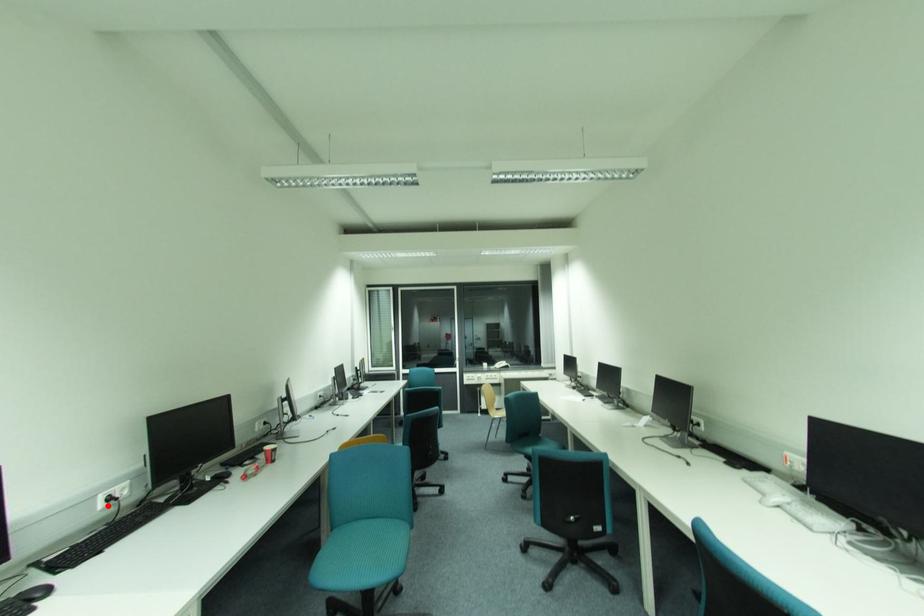
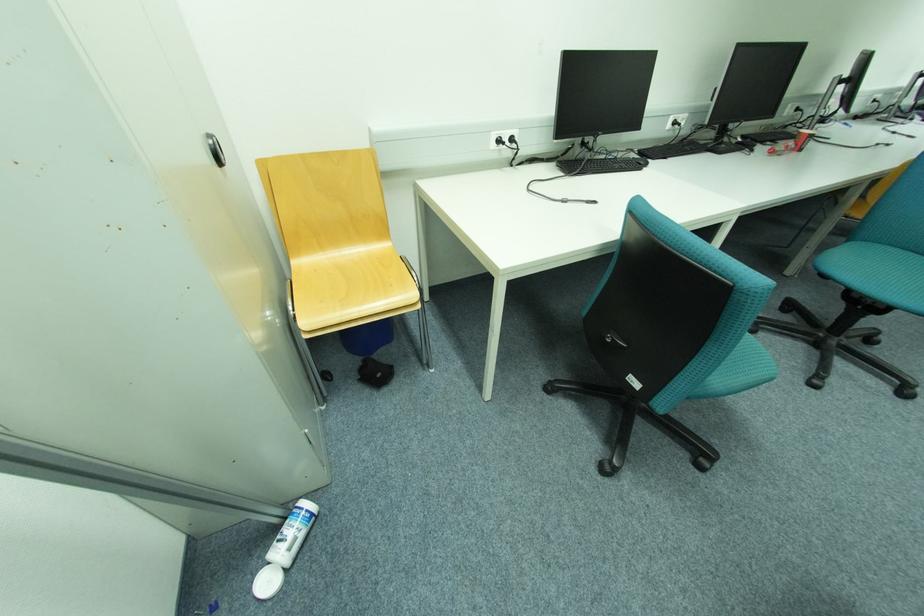
Locate, in the second image, the point that corresponds to the highlighted location in the first image.

(675, 126)